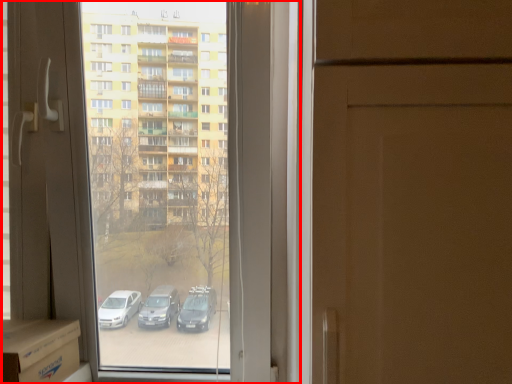
Question: Where is window (annotated by the red box) located in relation to cardboard box in the image?

Choices:
 (A) left
 (B) right

Answer: (B)